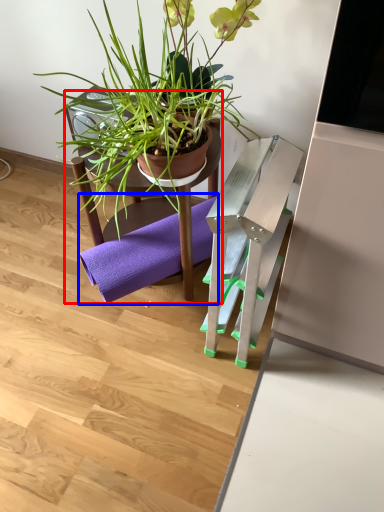
Question: Which object is closer to the camera taking this photo, chair (highlighted by a red box) or yoga mat (highlighted by a blue box)?

Choices:
 (A) chair
 (B) yoga mat

Answer: (A)